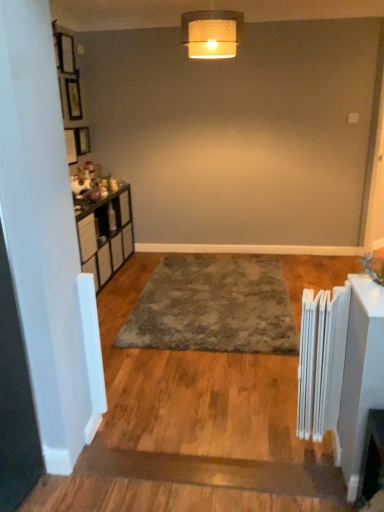
Question: Should I look upward or downward to see gray shaggy rug at center?

Choices:
 (A) down
 (B) up

Answer: (A)

Question: From a real-world perspective, is gray shaggy rug at center located beneath wooden picture frame at upper left?

Choices:
 (A) yes
 (B) no

Answer: (A)

Question: Can you confirm if gray shaggy rug at center is wider than wooden picture frame at upper left?

Choices:
 (A) no
 (B) yes

Answer: (B)

Question: Is gray shaggy rug at center positioned beyond the bounds of wooden picture frame at upper left?

Choices:
 (A) no
 (B) yes

Answer: (B)

Question: Is gray shaggy rug at center at the left side of wooden picture frame at upper left?

Choices:
 (A) no
 (B) yes

Answer: (A)

Question: Is gray shaggy rug at center positioned far away from wooden picture frame at upper left?

Choices:
 (A) yes
 (B) no

Answer: (A)

Question: Is gray shaggy rug at center bigger than wooden picture frame at upper left?

Choices:
 (A) no
 (B) yes

Answer: (B)

Question: Is gray shaggy rug at center further to the viewer compared to woven fabric lampshade at upper center?

Choices:
 (A) yes
 (B) no

Answer: (A)

Question: Can you see gray shaggy rug at center touching woven fabric lampshade at upper center?

Choices:
 (A) yes
 (B) no

Answer: (B)

Question: Is gray shaggy rug at center far from woven fabric lampshade at upper center?

Choices:
 (A) no
 (B) yes

Answer: (B)

Question: Is gray shaggy rug at center in front of woven fabric lampshade at upper center?

Choices:
 (A) no
 (B) yes

Answer: (A)

Question: Does gray shaggy rug at center appear on the left side of woven fabric lampshade at upper center?

Choices:
 (A) no
 (B) yes

Answer: (A)

Question: Is gray shaggy rug at center located outside woven fabric lampshade at upper center?

Choices:
 (A) yes
 (B) no

Answer: (A)

Question: From a real-world perspective, is wooden picture frame at upper left over woven fabric lampshade at upper center?

Choices:
 (A) yes
 (B) no

Answer: (B)